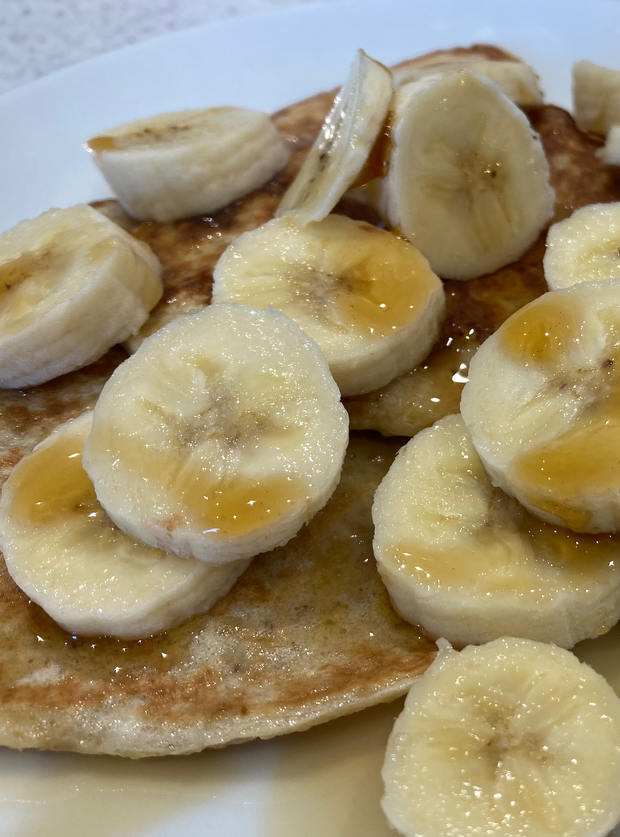
Where is `plate`? This screenshot has height=837, width=620. plate is located at coordinates (206, 59).